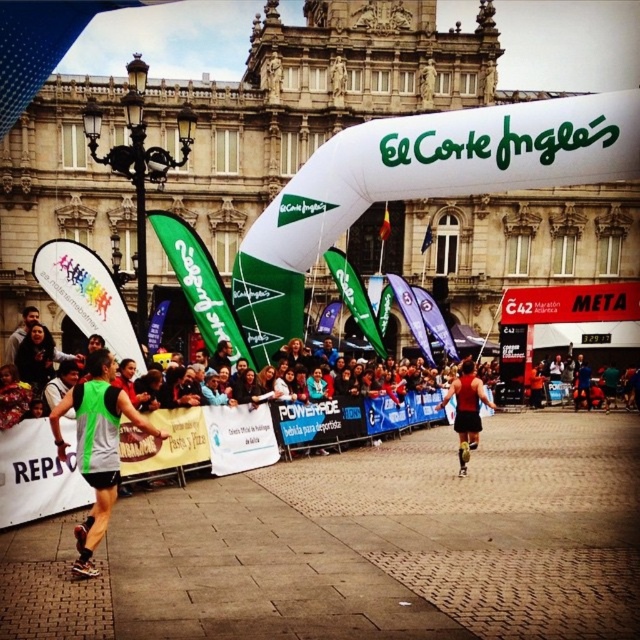
Question: Is the position of green fabric vest at left less distant than that of red matte tank top at center?

Choices:
 (A) yes
 (B) no

Answer: (A)

Question: Observing the image, what is the correct spatial positioning of green fabric vest at left in reference to red matte tank top at center?

Choices:
 (A) left
 (B) right

Answer: (A)

Question: Which point appears closest to the camera in this image?

Choices:
 (A) (118, 403)
 (B) (468, 436)

Answer: (A)

Question: Considering the relative positions of green fabric vest at left and red matte tank top at center in the image provided, where is green fabric vest at left located with respect to red matte tank top at center?

Choices:
 (A) above
 (B) below

Answer: (B)